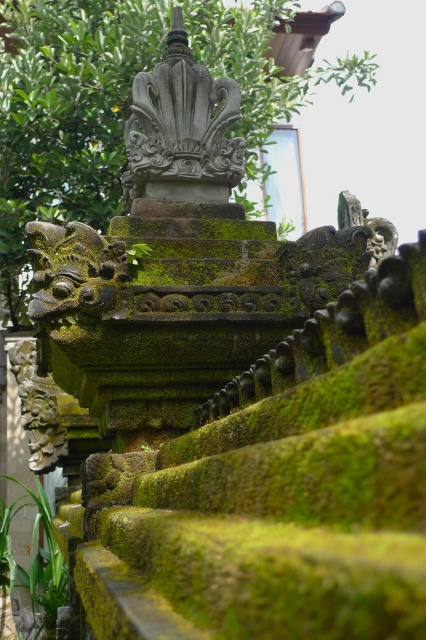
Question: Among these objects, which one is nearest to the camera?

Choices:
 (A) green mossy stone at center
 (B) gray stone sculpture at center

Answer: (B)

Question: Which point is farther to the camera?

Choices:
 (A) green mossy stone at center
 (B) gray stone sculpture at center

Answer: (A)

Question: Which of the following is the closest to the observer?

Choices:
 (A) (75, 20)
 (B) (160, 195)

Answer: (B)

Question: Can you confirm if green mossy stone at center is bigger than gray stone sculpture at center?

Choices:
 (A) yes
 (B) no

Answer: (A)

Question: Is green mossy stone at center closer to camera compared to gray stone sculpture at center?

Choices:
 (A) no
 (B) yes

Answer: (A)

Question: Considering the relative positions of green mossy stone at center and gray stone sculpture at center in the image provided, where is green mossy stone at center located with respect to gray stone sculpture at center?

Choices:
 (A) above
 (B) below

Answer: (A)